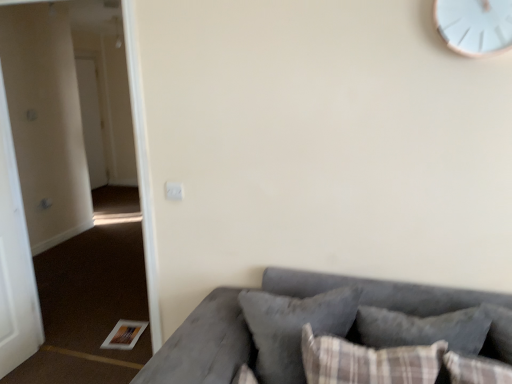
Identify the location of white plastic clock at upper right. Image resolution: width=512 pixels, height=384 pixels. (475, 25).

What is the approximate width of white plastic clock at upper right?

white plastic clock at upper right is 3.77 centimeters in width.

How much space does white glossy door at left, positioned as the second door in right-to-left order, occupy horizontally?

It is 3.29 inches.

Locate an element on the screen. white matte door at left, which is the second door from left to right is located at coordinates (15, 260).

I want to click on white plastic clock at upper right, so click(x=475, y=25).

Is plaid fabric pillow at lower right, the 2th pillow in the back-to-front sequence, bigger than white glossy door at left, the second door positioned from the front?

No.

From a real-world perspective, which object stands above the other?

From a 3D spatial view, white glossy door at left, the second door positioned from the front, is above.

Which of these two, plaid fabric pillow at lower right, the first pillow from the front, or white matte door at left, the 1th door viewed from the right, stands shorter?

Standing shorter between the two is plaid fabric pillow at lower right, the first pillow from the front.

Between plaid fabric pillow at lower right, the first pillow from the front, and white matte door at left, placed as the second door when sorted from back to front, which one has smaller width?

Thinner between the two is white matte door at left, placed as the second door when sorted from back to front.

Identify the location of pillow that is the 2nd object located in front of the white matte door at left, which is the second door from left to right. (368, 361).

How much distance is there between plaid fabric pillow at lower right, the first pillow from the front, and white matte door at left, the 1th door in the front-to-back sequence?

plaid fabric pillow at lower right, the first pillow from the front, and white matte door at left, the 1th door in the front-to-back sequence, are 6.97 feet apart.

Considering the sizes of objects white plastic clock at upper right and plaid fabric pillow at lower right, the first pillow from the front, in the image provided, who is wider, white plastic clock at upper right or plaid fabric pillow at lower right, the first pillow from the front,?

plaid fabric pillow at lower right, the first pillow from the front, is wider.

From their relative heights in the image, would you say white plastic clock at upper right is taller or shorter than plaid fabric pillow at lower right, the first pillow from the front?

Clearly, white plastic clock at upper right is taller compared to plaid fabric pillow at lower right, the first pillow from the front.

Is white plastic clock at upper right in front of plaid fabric pillow at lower right, the 2th pillow in the back-to-front sequence?

That is False.

Are white plastic clock at upper right and plaid fabric pillow at lower right, the first pillow from the front, located far from each other?

That's right, there is a large distance between white plastic clock at upper right and plaid fabric pillow at lower right, the first pillow from the front.

The width and height of the screenshot is (512, 384). What are the coordinates of `door above the brown carpet at lower left (from a real-world perspective)` in the screenshot? It's located at (91, 122).

Is brown carpet at lower left at the back of white glossy door at left, placed as the first door when sorted from back to front?

white glossy door at left, placed as the first door when sorted from back to front, does not have its back to brown carpet at lower left.

Does white glossy door at left, positioned as the second door in right-to-left order, have a greater width compared to brown carpet at lower left?

Incorrect, the width of white glossy door at left, positioned as the second door in right-to-left order, does not surpass that of brown carpet at lower left.

Is white glossy door at left, the second door positioned from the front, behind brown carpet at lower left?

Yes, the depth of white glossy door at left, the second door positioned from the front, is greater than that of brown carpet at lower left.

Is white matte door at left, the 1th door in the front-to-back sequence, surrounding plaid fabric pillow at lower right, the first pillow from the front?

No, white matte door at left, the 1th door in the front-to-back sequence, does not contain plaid fabric pillow at lower right, the first pillow from the front.

From a real-world perspective, does white matte door at left, the 1th door viewed from the right, sit lower than plaid fabric pillow at lower right, the first pillow from the front?

Incorrect, from a real-world perspective, white matte door at left, the 1th door viewed from the right, is higher than plaid fabric pillow at lower right, the first pillow from the front.

Looking at this image, looking at their sizes, would you say white matte door at left, which is the second door from left to right, is wider or thinner than plaid fabric pillow at lower right, the first pillow from the front?

In the image, white matte door at left, which is the second door from left to right, appears to be more narrow than plaid fabric pillow at lower right, the first pillow from the front.

Does white matte door at left, which is the second door from left to right, have a larger size compared to plaid fabric pillow at lower right, the 2th pillow in the back-to-front sequence?

Yes, white matte door at left, which is the second door from left to right, is bigger than plaid fabric pillow at lower right, the 2th pillow in the back-to-front sequence.

Considering the sizes of plaid fabric pillow at lower right, the first pillow from the front, and velvet gray pillow at lower center, the 2th pillow in the front-to-back sequence, in the image, is plaid fabric pillow at lower right, the first pillow from the front, bigger or smaller than velvet gray pillow at lower center, the 2th pillow in the front-to-back sequence,?

Clearly, plaid fabric pillow at lower right, the first pillow from the front, is smaller in size than velvet gray pillow at lower center, the 2th pillow in the front-to-back sequence.

Locate an element on the screen. The width and height of the screenshot is (512, 384). pillow directly beneath the plaid fabric pillow at lower right, the first pillow from the front (from a real-world perspective) is located at coordinates (293, 328).

Considering the points (335, 368) and (290, 309), which point is in front, point (335, 368) or point (290, 309)?

The point (335, 368) is in front.

Considering the positions of objects plaid fabric pillow at lower right, the 2th pillow in the back-to-front sequence, and velvet gray pillow at lower center, marked as the 1th pillow in a back-to-front arrangement, in the image provided, who is in front, plaid fabric pillow at lower right, the 2th pillow in the back-to-front sequence, or velvet gray pillow at lower center, marked as the 1th pillow in a back-to-front arrangement,?

plaid fabric pillow at lower right, the 2th pillow in the back-to-front sequence, is in front.

Which of these two, white glossy door at left, which appears as the 1th door when viewed from the left, or white plastic clock at upper right, is smaller?

white plastic clock at upper right is smaller.

Could you tell me if white glossy door at left, which appears as the 1th door when viewed from the left, is turned towards white plastic clock at upper right?

No, white glossy door at left, which appears as the 1th door when viewed from the left, is not facing towards white plastic clock at upper right.

Which is more to the left, white glossy door at left, which appears as the 1th door when viewed from the left, or white plastic clock at upper right?

Positioned to the left is white glossy door at left, which appears as the 1th door when viewed from the left.

From the image's perspective, who appears lower, white glossy door at left, positioned as the second door in right-to-left order, or white plastic clock at upper right?

From the image's view, white plastic clock at upper right is below.

Where is `the 2nd door behind the plaid fabric pillow at lower right, the 2th pillow in the back-to-front sequence`? the 2nd door behind the plaid fabric pillow at lower right, the 2th pillow in the back-to-front sequence is located at coordinates (91, 122).

From the plaid fabric pillow at lower right, the 2th pillow in the back-to-front sequence, count the 1st door to the left and point to it. Please provide its 2D coordinates.

[(15, 260)]

When comparing their distances from brown carpet at lower left, does white matte door at left, the 1th door viewed from the right, or velvet gray pillow at lower center, the 2th pillow in the front-to-back sequence, seem closer?

The object closer to brown carpet at lower left is white matte door at left, the 1th door viewed from the right.

Estimate the real-world distances between objects in this image. Which object is closer to white matte door at left, the 1th door viewed from the right, velvet gray pillow at lower center, the 2th pillow in the front-to-back sequence, or brown carpet at lower left?

Based on the image, brown carpet at lower left appears to be nearer to white matte door at left, the 1th door viewed from the right.

Estimate the real-world distances between objects in this image. Which object is closer to white glossy door at left, the second door positioned from the front, white matte door at left, placed as the second door when sorted from back to front, or velvet gray couch at lower right?

Based on the image, white matte door at left, placed as the second door when sorted from back to front, appears to be nearer to white glossy door at left, the second door positioned from the front.

From the image, which object appears to be farther from white glossy door at left, placed as the first door when sorted from back to front, velvet gray pillow at lower center, the 2th pillow in the front-to-back sequence, or plaid fabric pillow at lower right, the first pillow from the front?

Among the two, plaid fabric pillow at lower right, the first pillow from the front, is located further to white glossy door at left, placed as the first door when sorted from back to front.

From the picture: Based on their spatial positions, is plaid fabric pillow at lower right, the first pillow from the front, or white glossy door at left, which appears as the 1th door when viewed from the left, closer to velvet gray couch at lower right?

plaid fabric pillow at lower right, the first pillow from the front, lies closer to velvet gray couch at lower right than the other object.

When comparing their distances from white glossy door at left, positioned as the second door in right-to-left order, does velvet gray couch at lower right or white plastic clock at upper right seem further?

white plastic clock at upper right lies further to white glossy door at left, positioned as the second door in right-to-left order, than the other object.

Which object lies further to the anchor point brown carpet at lower left, velvet gray pillow at lower center, the 2th pillow in the front-to-back sequence, or plaid fabric pillow at lower right, the first pillow from the front?

plaid fabric pillow at lower right, the first pillow from the front, lies further to brown carpet at lower left than the other object.

When comparing their distances from white plastic clock at upper right, does brown carpet at lower left or velvet gray couch at lower right seem further?

brown carpet at lower left is positioned further to the anchor white plastic clock at upper right.

Image resolution: width=512 pixels, height=384 pixels. I want to click on clock between velvet gray pillow at lower center, the 2th pillow in the front-to-back sequence, and white glossy door at left, positioned as the second door in right-to-left order, from front to back, so click(x=475, y=25).

Where is `door located between plaid fabric pillow at lower right, the 2th pillow in the back-to-front sequence, and white glossy door at left, positioned as the second door in right-to-left order, in the depth direction`? Image resolution: width=512 pixels, height=384 pixels. door located between plaid fabric pillow at lower right, the 2th pillow in the back-to-front sequence, and white glossy door at left, positioned as the second door in right-to-left order, in the depth direction is located at coordinates (15, 260).

You are a GUI agent. You are given a task and a screenshot of the screen. Output one action in this format:
    pyautogui.click(x=<x>, y=<y>)
    Task: Click on the studio couch between white matte door at left, the 1th door in the front-to-back sequence, and white plastic clock at upper right from left to right
    
    Given the screenshot: What is the action you would take?
    pyautogui.click(x=202, y=345)

In order to click on studio couch located between white matte door at left, the 1th door in the front-to-back sequence, and plaid fabric pillow at lower right, the 2th pillow in the back-to-front sequence, in the left-right direction in this screenshot , I will do `click(202, 345)`.